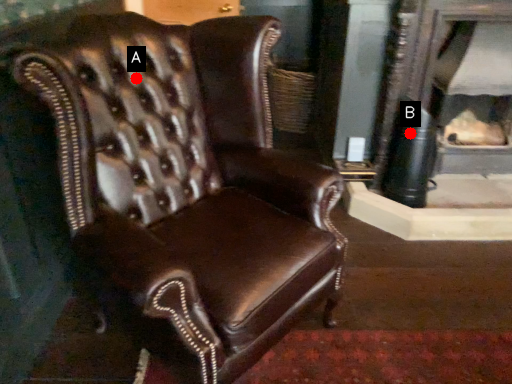
Question: Two points are circled on the image, labeled by A and B beside each circle. Which point is farther to the camera?

Choices:
 (A) A is further
 (B) B is further

Answer: (B)